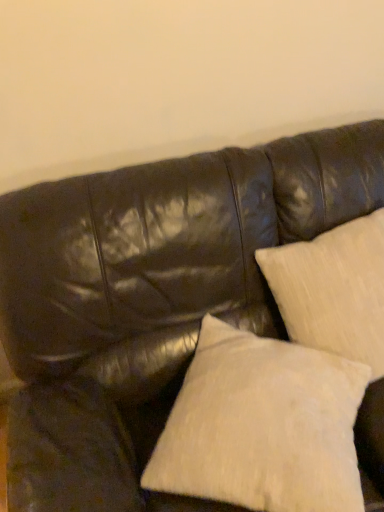
Question: From a real-world perspective, is white textured pillow at lower right, which is the second pillow in right-to-left order, above or below beige textured pillow at upper right, arranged as the second pillow when viewed from the left?

Choices:
 (A) above
 (B) below

Answer: (B)

Question: In terms of width, does white textured pillow at lower right, which is the second pillow in right-to-left order, look wider or thinner when compared to beige textured pillow at upper right, arranged as the second pillow when viewed from the left?

Choices:
 (A) wide
 (B) thin

Answer: (A)

Question: Relative to beige textured pillow at upper right, arranged as the second pillow when viewed from the left, is white textured pillow at lower right, the 1th pillow in the left-to-right sequence, in front or behind?

Choices:
 (A) behind
 (B) front

Answer: (B)

Question: Is beige textured pillow at upper right, the 1th pillow in the right-to-left sequence, spatially inside white textured pillow at lower right, the 1th pillow in the left-to-right sequence, or outside of it?

Choices:
 (A) outside
 (B) inside

Answer: (A)

Question: Considering the positions of beige textured pillow at upper right, the 1th pillow in the right-to-left sequence, and white textured pillow at lower right, the 1th pillow in the left-to-right sequence, in the image, is beige textured pillow at upper right, the 1th pillow in the right-to-left sequence, bigger or smaller than white textured pillow at lower right, the 1th pillow in the left-to-right sequence,?

Choices:
 (A) small
 (B) big

Answer: (B)

Question: Is point (354, 328) positioned closer to the camera than point (268, 451)?

Choices:
 (A) farther
 (B) closer

Answer: (A)

Question: Looking at their shapes, would you say beige textured pillow at upper right, the 1th pillow in the right-to-left sequence, is wider or thinner than white textured pillow at lower right, which is the second pillow in right-to-left order?

Choices:
 (A) wide
 (B) thin

Answer: (B)